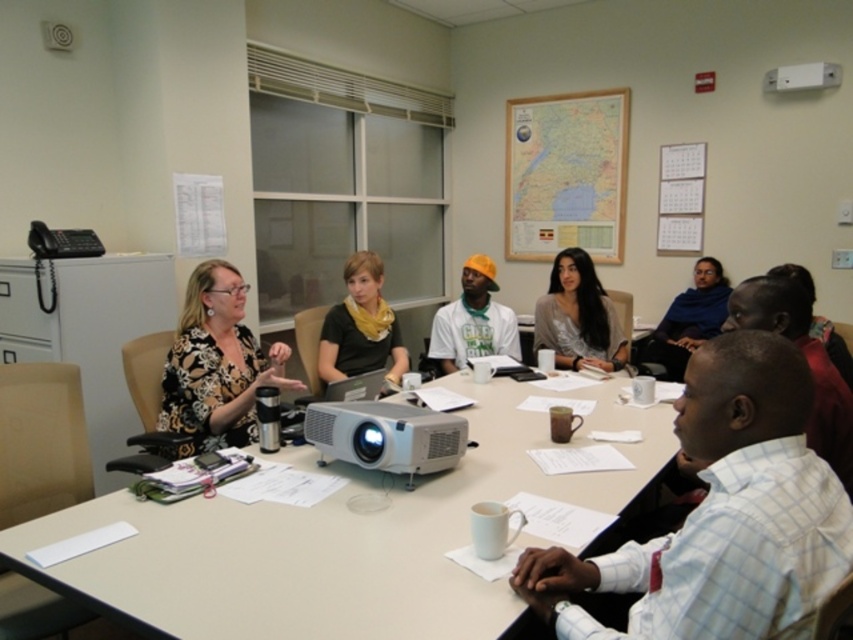
Question: Which object appears farthest from the camera in this image?

Choices:
 (A) white plastic table at center
 (B) white plastic projector at center
 (C) floral-patterned blouse at center

Answer: (C)

Question: Does white plastic table at center have a greater width compared to floral-patterned blouse at center?

Choices:
 (A) yes
 (B) no

Answer: (A)

Question: Is white plastic table at center to the right of white plastic projector at center from the viewer's perspective?

Choices:
 (A) no
 (B) yes

Answer: (B)

Question: Among these points, which one is farthest from the camera?

Choices:
 (A) (610, 358)
 (B) (100, 564)
 (C) (178, 403)

Answer: (A)

Question: Is floral-patterned blouse at center wider than shiny silver blouse at center?

Choices:
 (A) no
 (B) yes

Answer: (B)

Question: Which of the following is the farthest from the observer?

Choices:
 (A) white plastic projector at center
 (B) floral-patterned blouse at center
 (C) shiny silver blouse at center

Answer: (C)